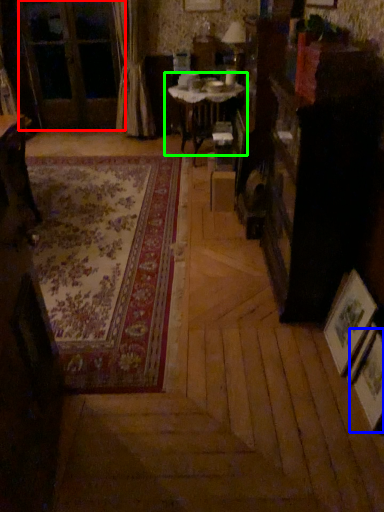
Question: Considering the real-world distances, which object is closest to screen door (highlighted by a red box)? picture frame (highlighted by a blue box) or table (highlighted by a green box).

Choices:
 (A) picture frame
 (B) table

Answer: (B)